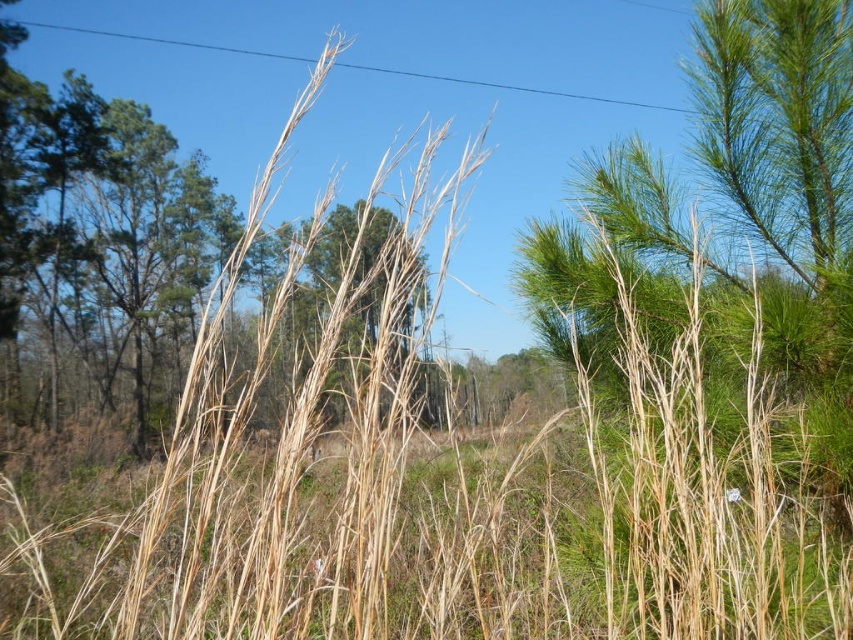
Based on the photo, can you confirm if dry straw grass at center is taller than dry grass at center?

Incorrect, dry straw grass at center's height is not larger of dry grass at center's.

Does dry straw grass at center appear on the left side of dry grass at center?

No, dry straw grass at center is not to the left of dry grass at center.

Who is more distant from viewer, (560,460) or (398,387)?

The point (560,460) is behind.

Find the location of a particular element. dry straw grass at center is located at coordinates (561, 552).